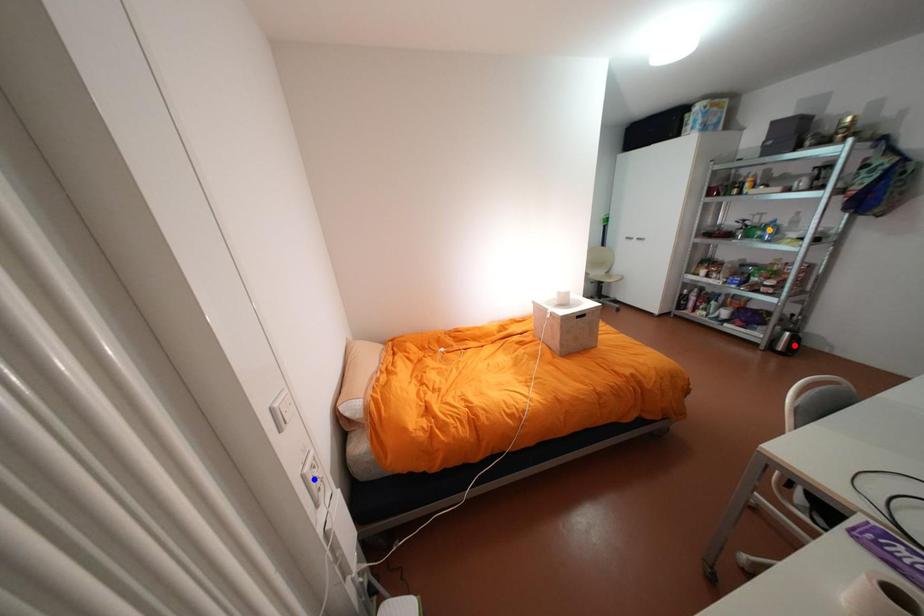
Order these from farthest to nearest:
red point
blue point
orange point

red point → orange point → blue point